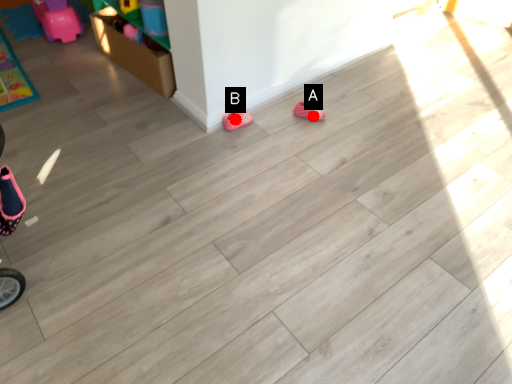
Question: Two points are circled on the image, labeled by A and B beside each circle. Among these points, which one is nearest to the camera?

Choices:
 (A) A is closer
 (B) B is closer

Answer: (B)